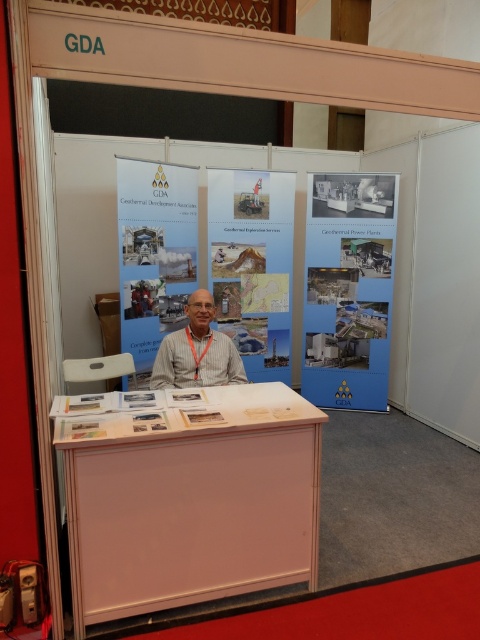
You are standing at the entrance of the GDA booth and notice two points marked on the banners. The first point is at coordinates point (184, 588) and the second is at point (216, 224). Which point is closer to you?

Point (184, 588) is closer to the camera than point (216, 224), so the first point is closer to you.